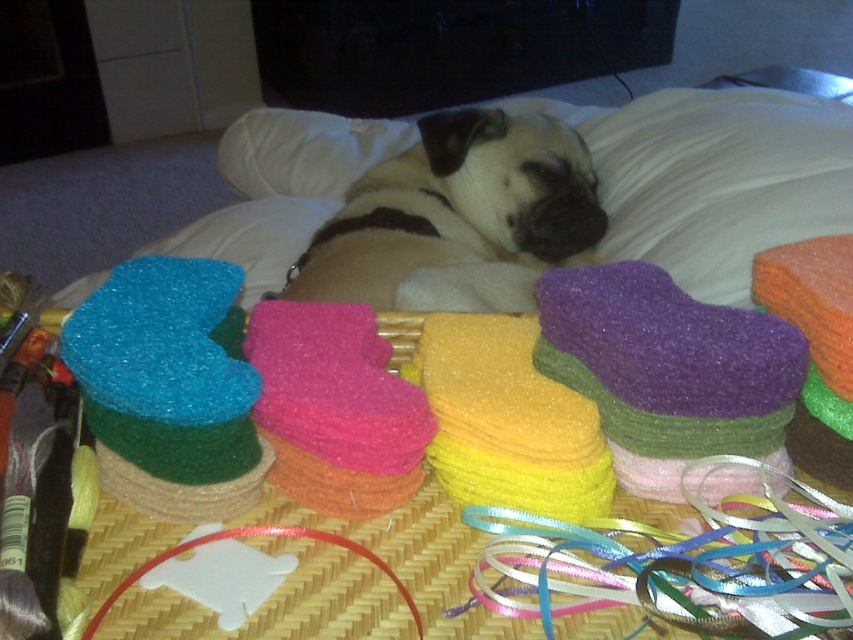
Question: Does matte beige dog at center have a greater width compared to blue glittery heart at left?

Choices:
 (A) no
 (B) yes

Answer: (B)

Question: Does matte beige dog at center lie in front of blue glittery heart at left?

Choices:
 (A) no
 (B) yes

Answer: (A)

Question: Can you confirm if matte beige dog at center is wider than blue glittery heart at left?

Choices:
 (A) yes
 (B) no

Answer: (A)

Question: Which point is closer to the camera?

Choices:
 (A) blue glittery heart at left
 (B) matte beige dog at center

Answer: (A)